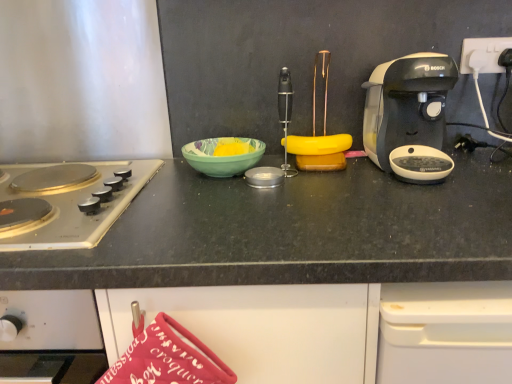
What are the coordinates of `vacant area that is in front of green glossy bowl at center` in the screenshot? It's located at (219, 194).